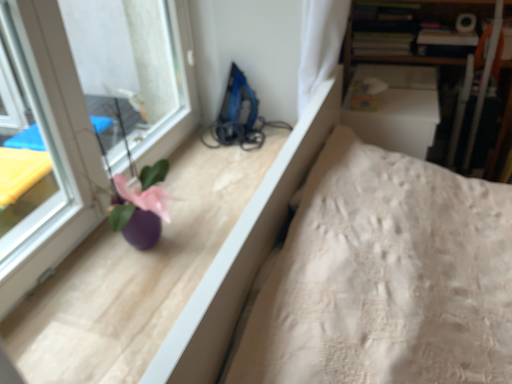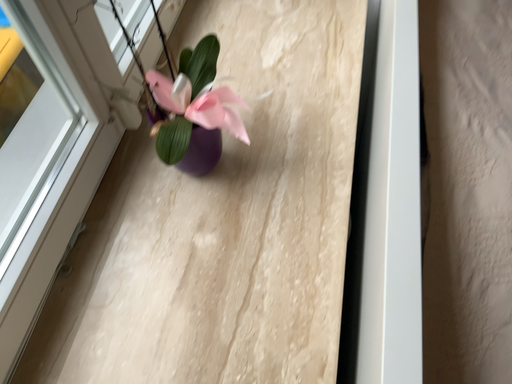
Question: How did the camera likely rotate when shooting the video?

Choices:
 (A) rotated downward
 (B) rotated upward

Answer: (A)